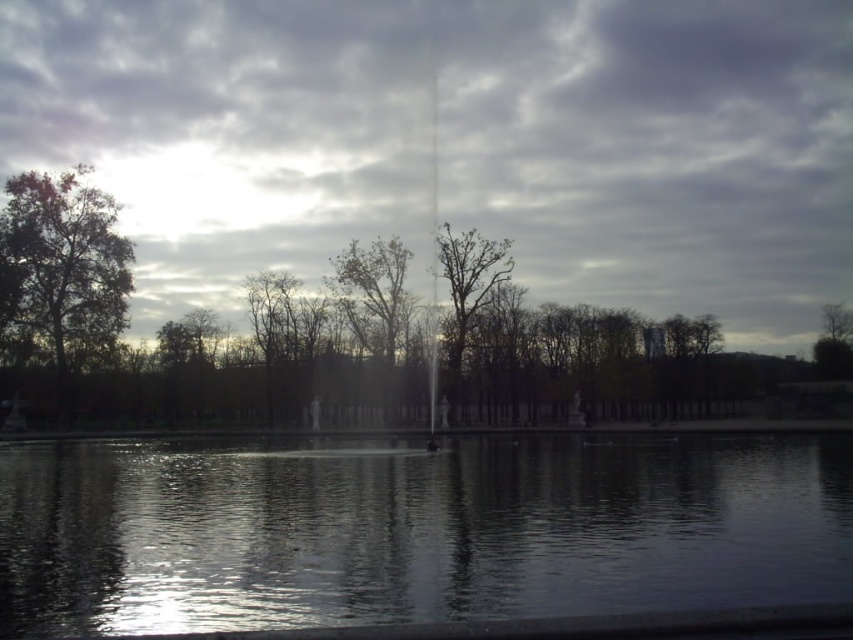
What do you see at coordinates (413, 529) in the screenshot? The image size is (853, 640). I see `transparent water at center` at bounding box center [413, 529].

Who is higher up, transparent water at center or bare branches tree at center?

bare branches tree at center

Does point (310, 493) come in front of point (498, 248)?

Yes, point (310, 493) is closer to viewer.

Locate an element on the screen. Image resolution: width=853 pixels, height=640 pixels. transparent water at center is located at coordinates (413, 529).

Can you confirm if transparent water at center is positioned to the left of bare branches at center?

Incorrect, transparent water at center is not on the left side of bare branches at center.

Can you confirm if transparent water at center is wider than bare branches at center?

Indeed, transparent water at center has a greater width compared to bare branches at center.

Find the location of a particular element. The height and width of the screenshot is (640, 853). transparent water at center is located at coordinates (413, 529).

Does gray cloudy sky at upper center have a lesser height compared to bare branches tree at center?

No, gray cloudy sky at upper center is not shorter than bare branches tree at center.

Does gray cloudy sky at upper center have a smaller size compared to bare branches tree at center?

No.

Which is behind, point (527, 118) or point (451, 294)?

Positioned behind is point (527, 118).

Locate an element on the screen. The width and height of the screenshot is (853, 640). gray cloudy sky at upper center is located at coordinates (457, 144).